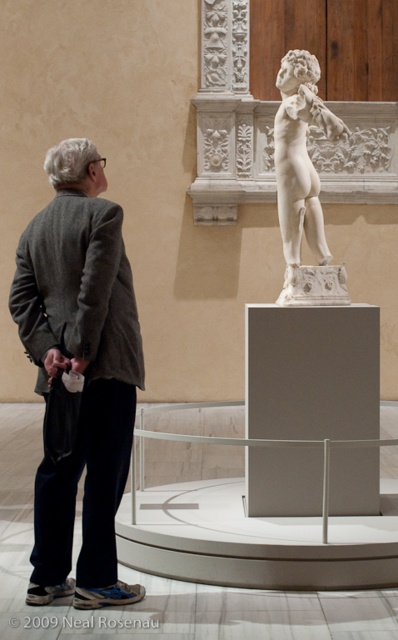
Question: Can you confirm if gray wool jacket at left is positioned to the right of white marble statue at center?

Choices:
 (A) yes
 (B) no

Answer: (B)

Question: Which of the following is the farthest from the observer?

Choices:
 (A) white marble statue at center
 (B) gray wool jacket at left

Answer: (A)

Question: Can you confirm if gray wool jacket at left is bigger than white marble statue at center?

Choices:
 (A) yes
 (B) no

Answer: (A)

Question: Can you confirm if gray wool jacket at left is wider than white marble statue at center?

Choices:
 (A) yes
 (B) no

Answer: (A)